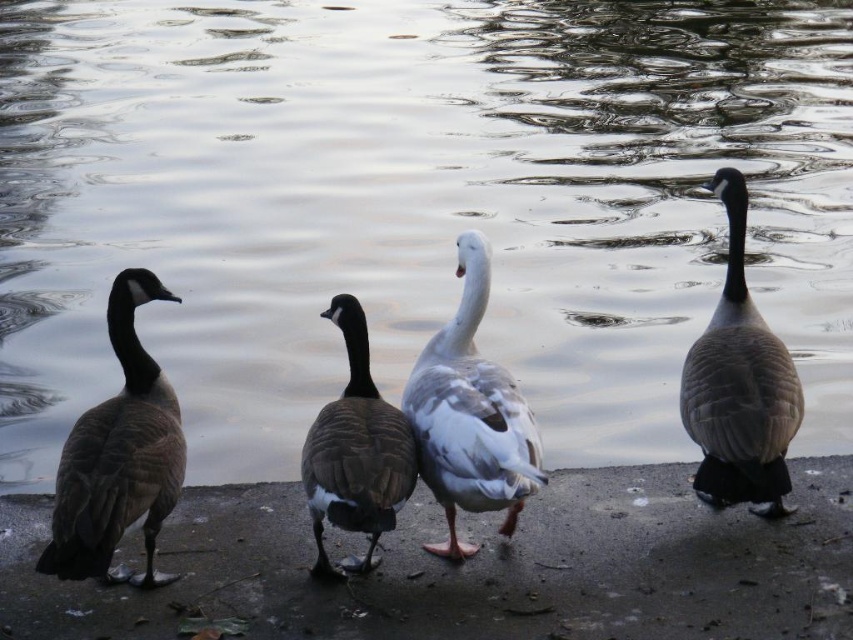
You are a wildlife photographer trying to capture a closeup shot of the dark brown feathers at left and the brown matte duck at center. Based on their sizes, which one would require you to get closer to fill the frame?

The dark brown feathers at left is thinner than the brown matte duck at center, so you would need to get closer to the dark brown feathers at left to fill the frame since it is smaller.

You are a birdwatcher trying to identify the tallest bird between the white matte duck at center and the brown feathered goose at right. Based on the scene, which one is taller?

The brown feathered goose at right is taller than the white matte duck at center.